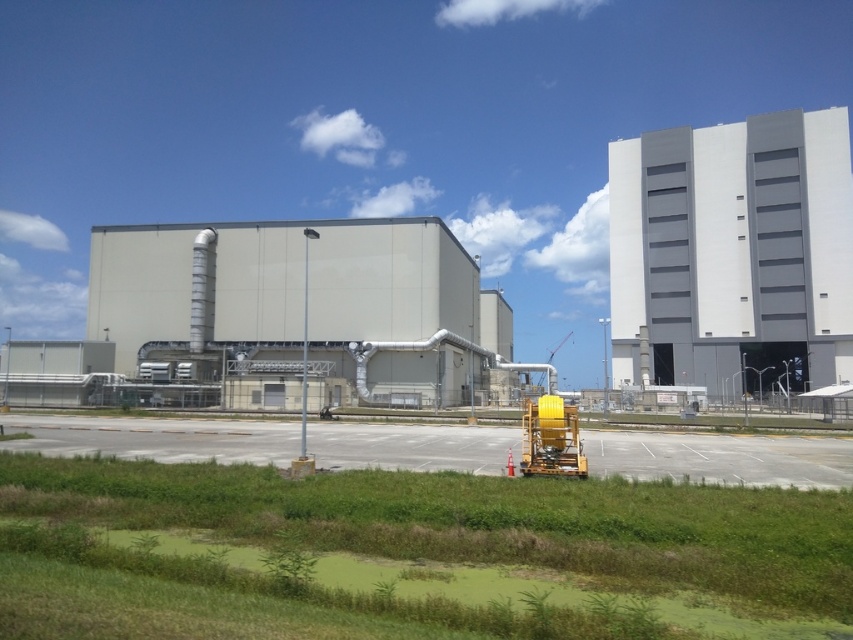
Consider the image. You are standing in the industrial area depicted in the image. You need to reach the gray concrete factory at center for a meeting. If your walking speed is 1.5 meters per second, how many seconds will it take you to reach the factory?

The gray concrete factory at center is 56.65 meters away from the viewer. At a walking speed of 1.5 meters per second, it will take approximately 37.77 seconds to reach the factory.

You are standing at the point marked by the coordinate point at the center of the image, which is point (398, 320). You want to walk directly towards the large industrial building in the midground. How far will you have to walk to reach the building from your current position?

The point (398, 320) is 63.74 meters from the viewer, so you will have to walk 63.74 meters to reach the building.

Based on the photo, you are a delivery driver who needs to park your truck between the gray concrete factory at center and the gray concrete building at upper right. Based on their positions, can you determine which side of the factory you should park on to be closer to the building?

The gray concrete factory at center is located below the gray concrete building at upper right, so parking on the upper side of the factory would place you closer to the building.